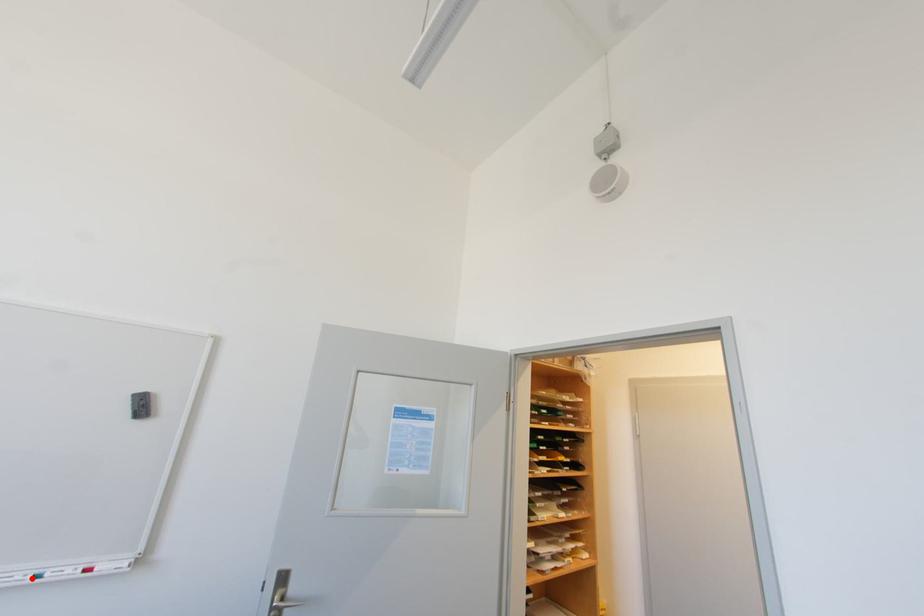
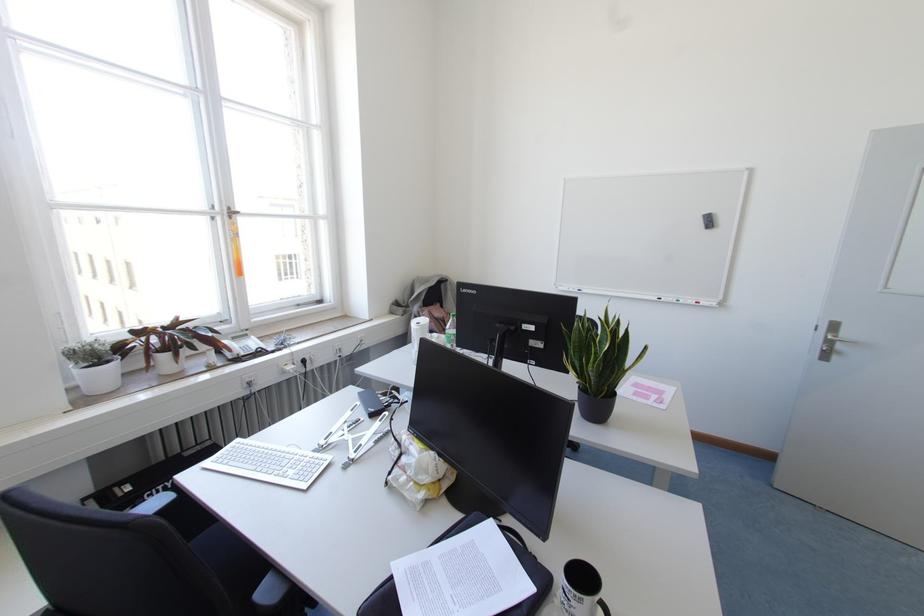
Where in the second image is the point corresponding to the highlighted location from the first image?

(676, 300)